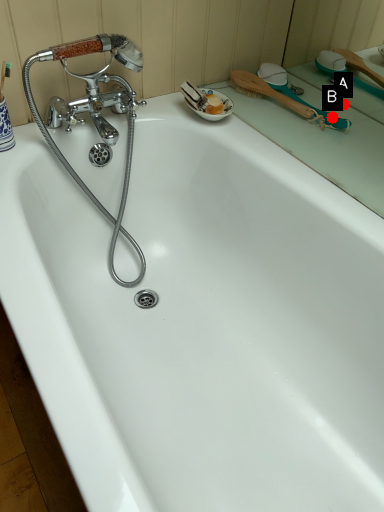
Question: Two points are circled on the image, labeled by A and B beside each circle. Which point is closer to the camera taking this photo?

Choices:
 (A) A is closer
 (B) B is closer

Answer: (B)